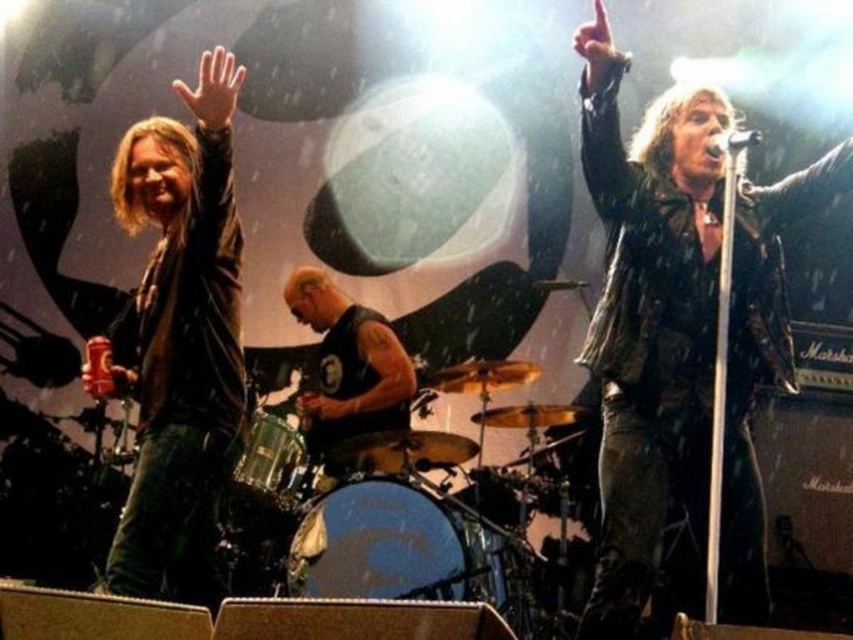
Question: Which point appears closest to the camera in this image?

Choices:
 (A) (294, 564)
 (B) (125, 566)

Answer: (B)

Question: Among these objects, which one is nearest to the camera?

Choices:
 (A) blue drumhead at center
 (B) shiny metallic drum at center
 (C) black leather vest at center

Answer: (B)

Question: Which point appears farthest from the camera in this image?

Choices:
 (A) (730, 317)
 (B) (373, 312)

Answer: (B)

Question: Is blue drumhead at center closer to camera compared to black leather vest at center?

Choices:
 (A) no
 (B) yes

Answer: (B)

Question: Is blue drumhead at center to the right of shiny metallic drum at center from the viewer's perspective?

Choices:
 (A) no
 (B) yes

Answer: (B)

Question: Does shiny black leather jacket at upper right appear on the left side of matte black leather jacket at left?

Choices:
 (A) no
 (B) yes

Answer: (A)